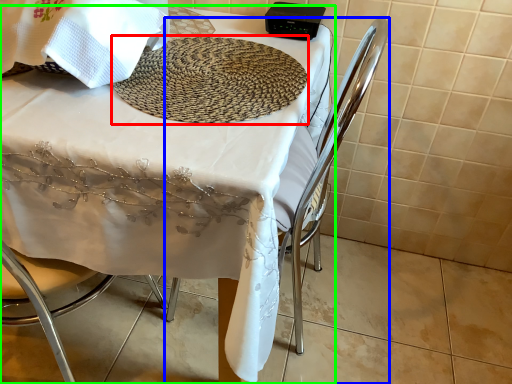
Question: Which is nearer to the mat (highlighted by a red box)? chair (highlighted by a blue box) or table (highlighted by a green box).

Choices:
 (A) chair
 (B) table

Answer: (B)